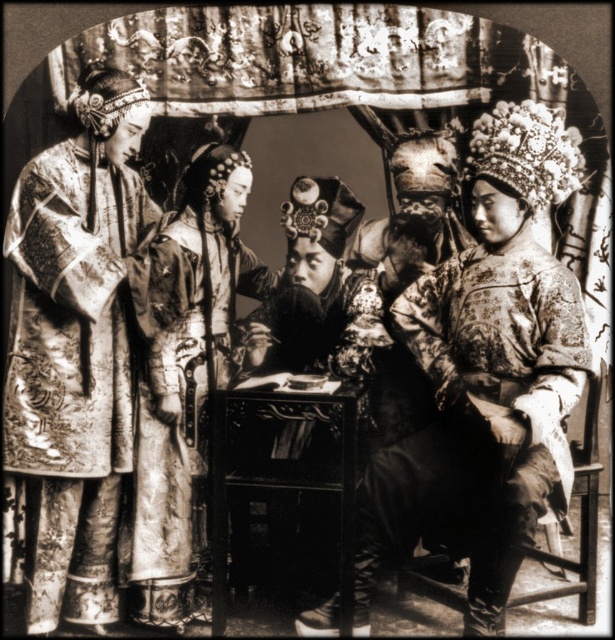
From the picture: In the scene described, where is the silky brocade robe at left positioned in relation to the ornate circular border?

The silky brocade robe at left is positioned at the coordinates 0.547 on the x axis and 0.122 on the y axis, which places it near the lower left quadrant of the image within the ornate circular border.